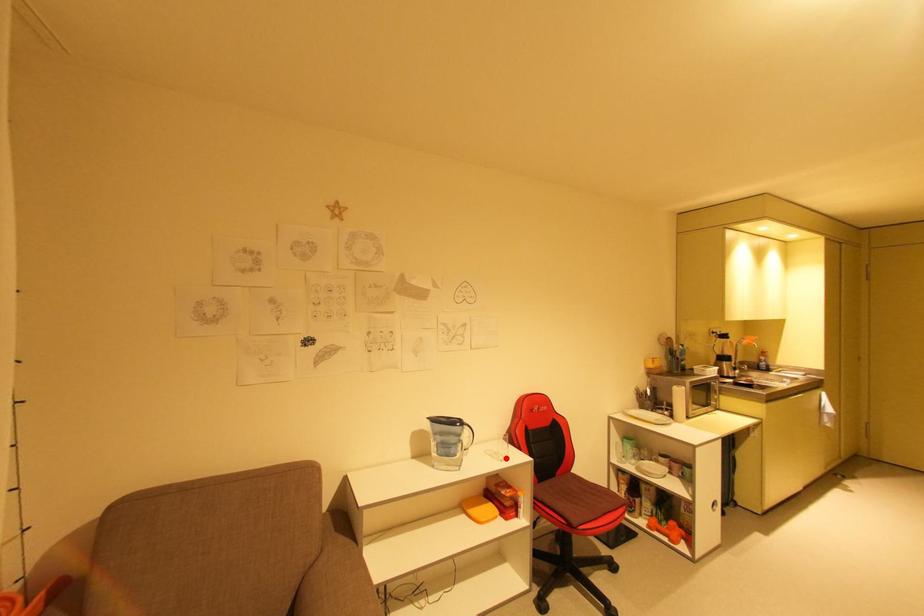
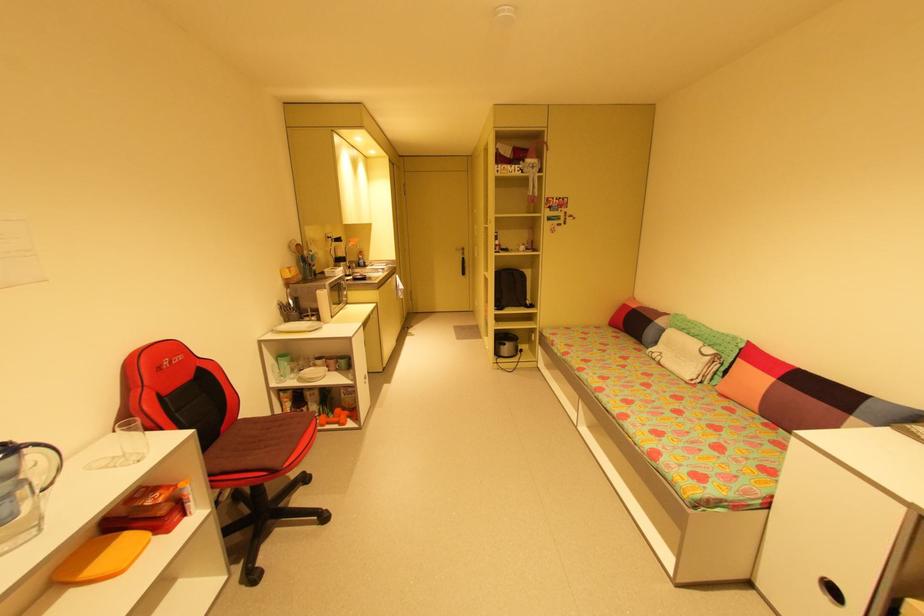
Question: I am providing you with two images of the same scene from different viewpoints. Image1 has a red point marked. In image2, the corresponding 3D location appears at what relative position? Reply with the corresponding letter.

Choices:
 (A) Closer
 (B) Farther

Answer: (A)